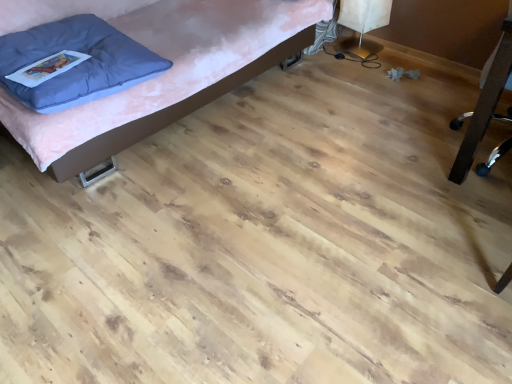
You are a GUI agent. You are given a task and a screenshot of the screen. Output one action in this format:
    pyautogui.click(x=<x>, y=<y>)
    Task: Click on the vacant space behind black plastic chair at right, the 2th furniture viewed from the left
    The height and width of the screenshot is (384, 512).
    Given the screenshot: What is the action you would take?
    pyautogui.click(x=426, y=92)